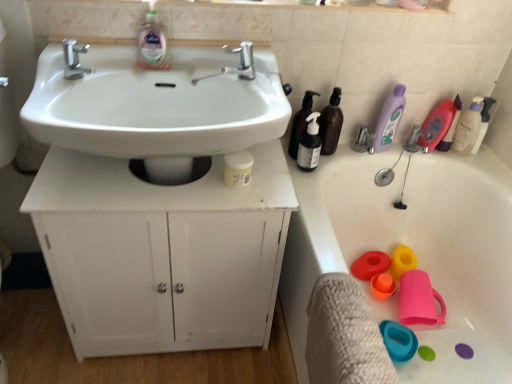
The height and width of the screenshot is (384, 512). In order to click on vacant space to the left of white matte jar at center, which ranks as the 1th toiletry in left-to-right order in this screenshot , I will do `click(174, 187)`.